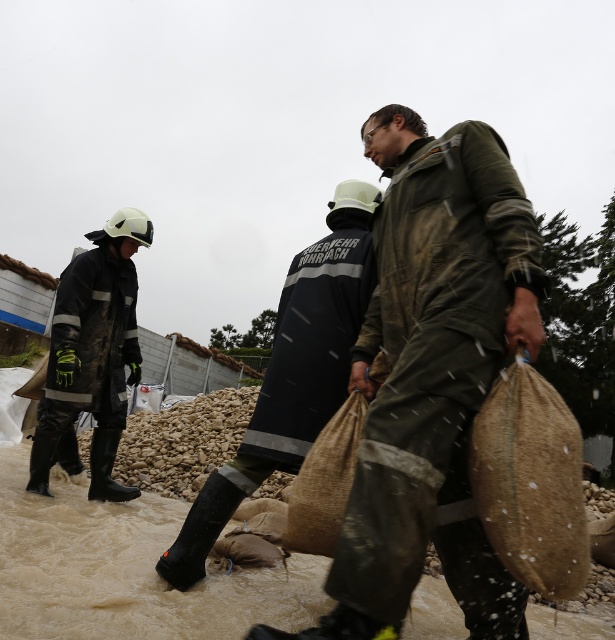
Question: Can you confirm if burlap sack at lower right is positioned to the right of rubberized black boots at left?

Choices:
 (A) yes
 (B) no

Answer: (A)

Question: Which of the following is the farthest from the observer?

Choices:
 (A) (240, 442)
 (B) (582, 529)
 (C) (108, 243)

Answer: (C)

Question: Which point is farther to the camera?

Choices:
 (A) dark blue uniform at center
 (B) green matte jacket at center
 (C) burlap sack at lower right

Answer: (A)

Question: Is dark blue uniform at center positioned behind rubberized black boots at left?

Choices:
 (A) yes
 (B) no

Answer: (B)

Question: Is green matte jacket at center positioned in front of rubberized black boots at left?

Choices:
 (A) no
 (B) yes

Answer: (B)

Question: Which object appears farthest from the camera in this image?

Choices:
 (A) rubberized black boots at left
 (B) green matte jacket at center
 (C) dark blue uniform at center
 (D) burlap sack at lower right

Answer: (A)